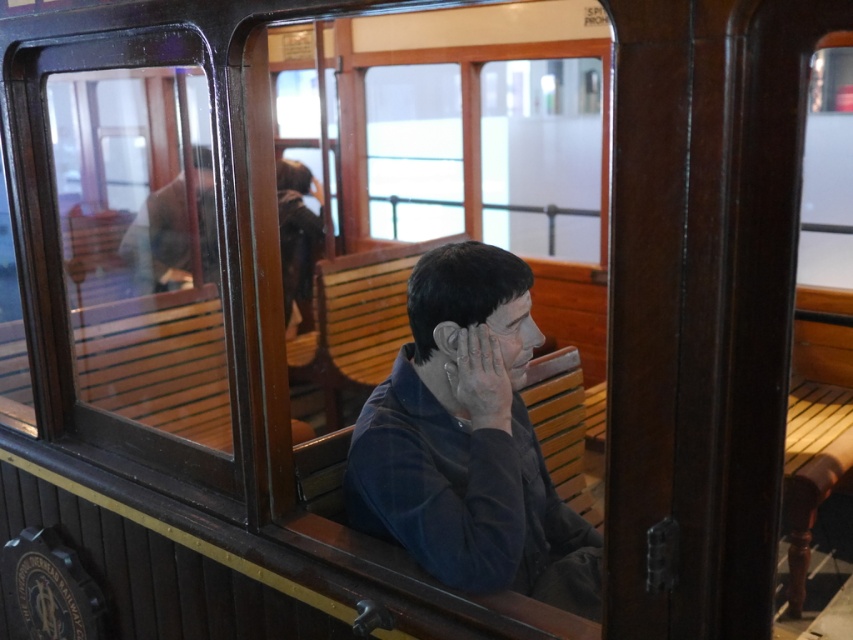
Question: Which point appears farthest from the camera in this image?

Choices:
 (A) (463, 400)
 (B) (485, 323)
 (C) (397, 413)

Answer: (C)

Question: Estimate the real-world distances between objects in this image. Which object is closer to the matte blue shirt at center?

Choices:
 (A) matte gray hand at center
 (B) matte black face at center

Answer: (A)

Question: Does matte blue shirt at center have a lesser width compared to matte black face at center?

Choices:
 (A) yes
 (B) no

Answer: (B)

Question: Among these points, which one is nearest to the camera?

Choices:
 (A) (488, 323)
 (B) (529, 433)
 (C) (463, 348)

Answer: (C)

Question: From the image, what is the correct spatial relationship of matte blue shirt at center in relation to matte gray hand at center?

Choices:
 (A) right
 (B) left

Answer: (B)

Question: Does matte gray hand at center have a larger size compared to matte black face at center?

Choices:
 (A) yes
 (B) no

Answer: (A)